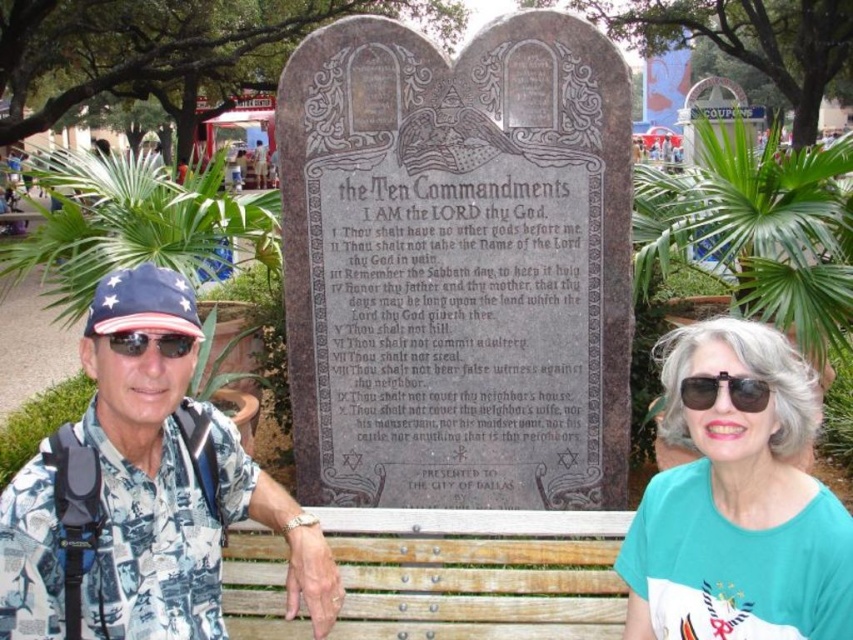
Question: Which point is farther to the camera?

Choices:
 (A) white printed shirt at left
 (B) sunglasses at left
 (C) black plastic sunglasses at center

Answer: (B)

Question: Estimate the real-world distances between objects in this image. Which object is farther from the sunglasses at left?

Choices:
 (A) teal fabric shirt at right
 (B) black plastic sunglasses at center
 (C) white printed shirt at left

Answer: (A)

Question: Which object is the closest to the black plastic sunglasses at center?

Choices:
 (A) white printed shirt at left
 (B) teal fabric shirt at right

Answer: (B)

Question: Is black plastic sunglasses at center to the left of sunglasses at left from the viewer's perspective?

Choices:
 (A) no
 (B) yes

Answer: (A)

Question: Does teal fabric shirt at right appear on the left side of black plastic sunglasses at center?

Choices:
 (A) no
 (B) yes

Answer: (A)

Question: Does white printed shirt at left appear under sunglasses at left?

Choices:
 (A) yes
 (B) no

Answer: (A)